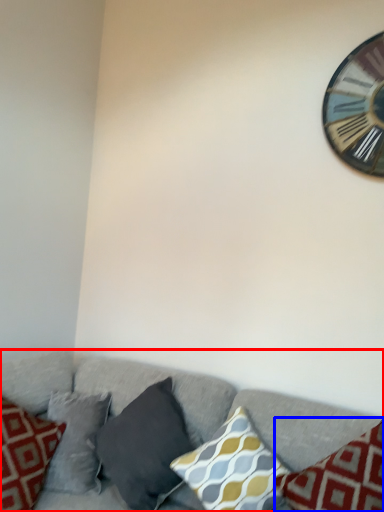
Question: Among these objects, which one is nearest to the camera, studio couch (highlighted by a red box) or pillow (highlighted by a blue box)?

Choices:
 (A) studio couch
 (B) pillow

Answer: (A)